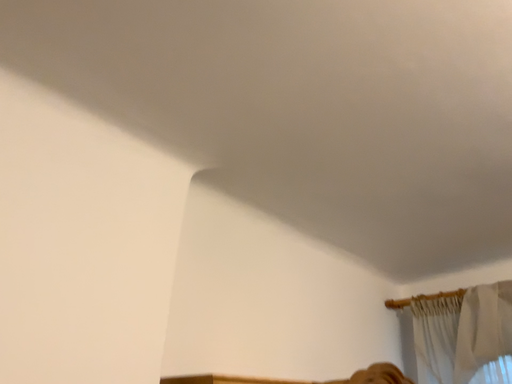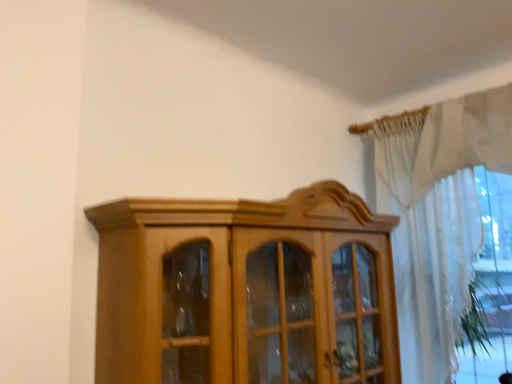
Question: How did the camera likely rotate when shooting the video?

Choices:
 (A) rotated upward
 (B) rotated downward

Answer: (B)